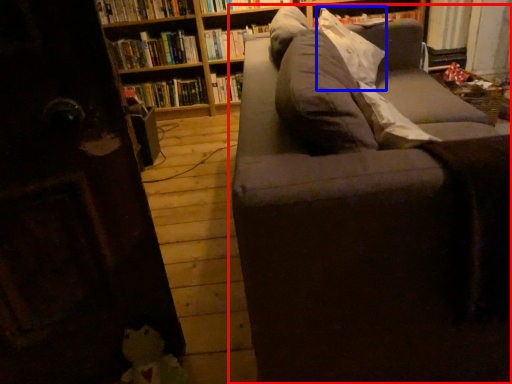
Question: Which point is closer to the camera, studio couch (highlighted by a red box) or pillow (highlighted by a blue box)?

Choices:
 (A) studio couch
 (B) pillow

Answer: (A)